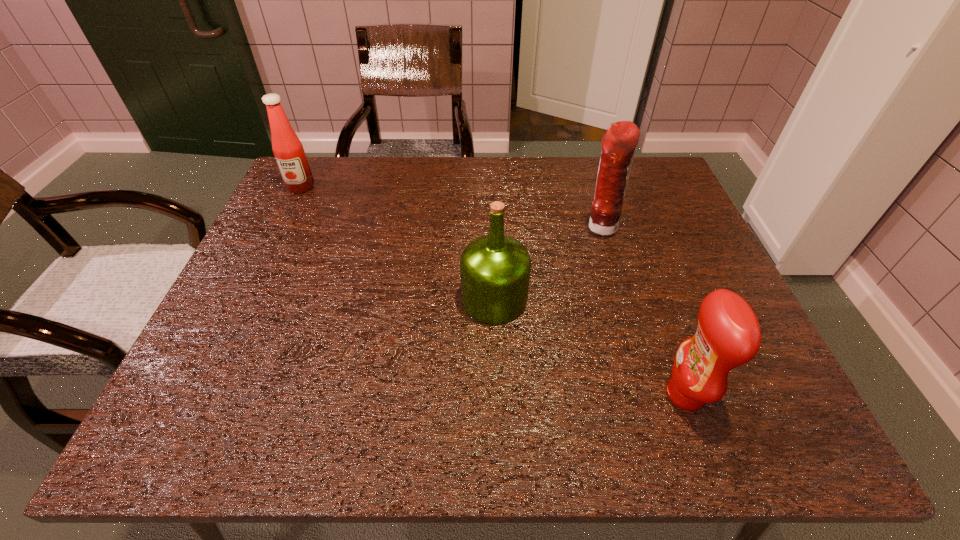
This screenshot has height=540, width=960. Identify the location of vacant space located 0.280m on the label side of the nearest object. (514, 394).

At what (x,y) coordinates should I click in order to perform the action: click on vacant space located on the label side of the nearest object. Please return your answer as a coordinate pair (x, y). The height and width of the screenshot is (540, 960). Looking at the image, I should click on click(x=503, y=394).

Image resolution: width=960 pixels, height=540 pixels. Find the location of `object that is positioned at the far edge`. object that is positioned at the far edge is located at coordinates (288, 150).

This screenshot has width=960, height=540. Find the location of `object located at the near edge`. object located at the near edge is located at coordinates (728, 335).

Locate an element on the screen. This screenshot has height=540, width=960. object at the left edge is located at coordinates (288, 150).

Find the location of a particular element. object present at the right edge is located at coordinates (728, 335).

This screenshot has height=540, width=960. Identify the location of object situated at the far left corner. (288, 150).

Image resolution: width=960 pixels, height=540 pixels. Find the location of `object at the near right corner`. object at the near right corner is located at coordinates (728, 335).

This screenshot has width=960, height=540. I want to click on free spot at the far edge of the desktop, so click(420, 158).

Where is `vacant area at the near edge`? vacant area at the near edge is located at coordinates (534, 437).